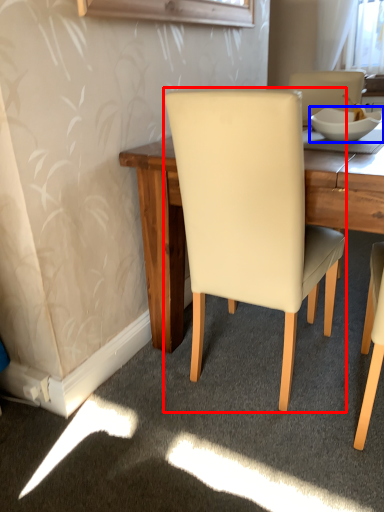
Question: Which object appears farthest to the camera in this image, chair (highlighted by a red box) or bowl (highlighted by a blue box)?

Choices:
 (A) chair
 (B) bowl

Answer: (B)